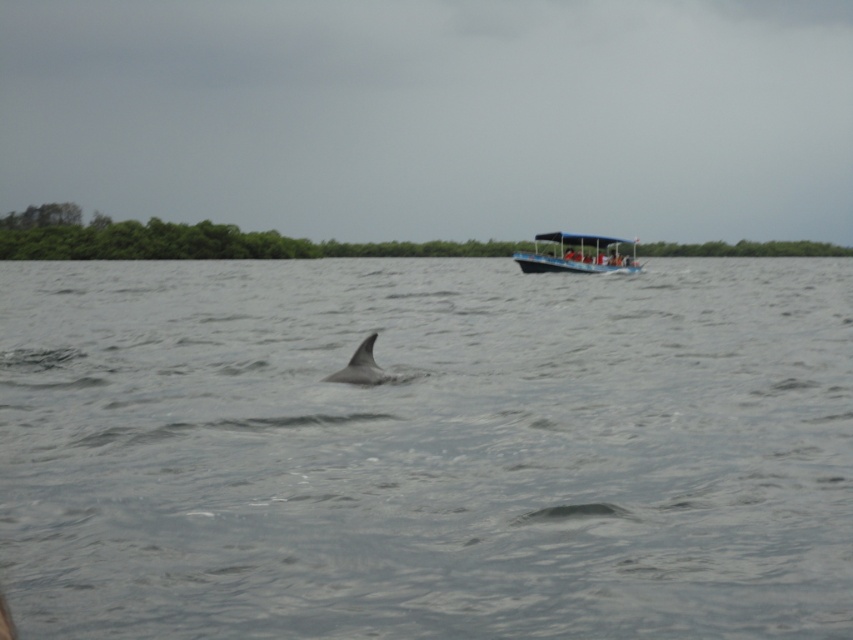
You are a passenger on the blue plastic boat at upper right and want to see the gray matte water at center. In which direction should you look from your position?

You should look to the left from your position on the blue plastic boat at upper right to see the gray matte water at center, as it is located to the left of the boat.

You are a marine biologist observing the scene. You need to determine which object occupies a larger area in the image between the gray matte water at center and the gray matte dolphin at center. Which one is it?

The gray matte water at center has a larger width than the gray matte dolphin at center, so the gray matte water at center occupies a larger area in the image.

You are a passenger on the blue plastic boat at upper right and want to see the gray matte water at center. Can you see it from your current position?

The gray matte water at center is in front of the blue plastic boat at upper right, so yes, the passenger can see the gray matte water at center from their current position.